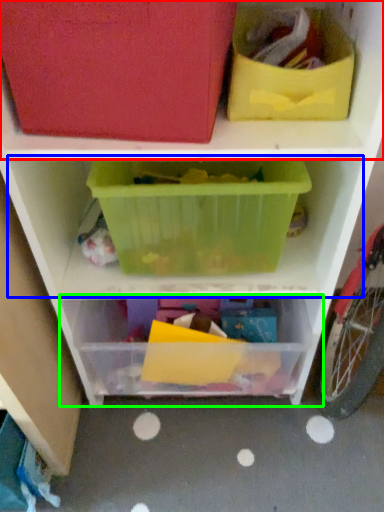
Question: Estimate the real-world distances between objects in this image. Which object is farther from shelf (highlighted by a red box), shelf (highlighted by a blue box) or shelf (highlighted by a green box)?

Choices:
 (A) shelf
 (B) shelf

Answer: (B)